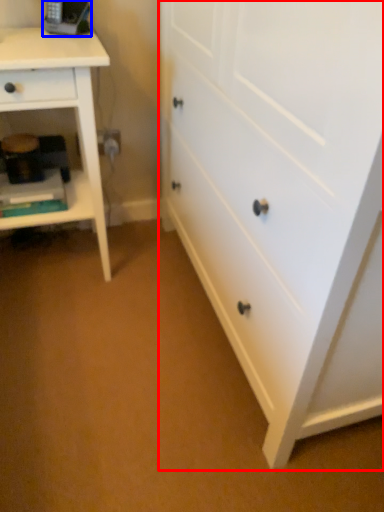
Question: Which object appears farthest to the camera in this image, chest of drawers (highlighted by a red box) or equipment (highlighted by a blue box)?

Choices:
 (A) chest of drawers
 (B) equipment

Answer: (B)